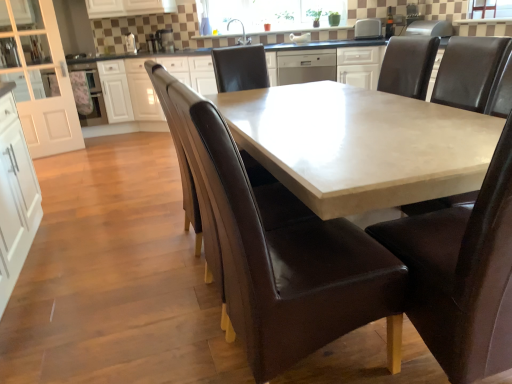
Question: Considering the positions of white glossy cabinet at center, acting as the first cabinetry starting from the right, and white plastic toaster at upper center, marked as the 1th appliance in a right-to-left arrangement, in the image, is white glossy cabinet at center, acting as the first cabinetry starting from the right, bigger or smaller than white plastic toaster at upper center, marked as the 1th appliance in a right-to-left arrangement,?

Choices:
 (A) small
 (B) big

Answer: (B)

Question: Is white glossy cabinet at center, which is the 2th cabinetry from left to right, to the left or to the right of white plastic toaster at upper center, which ranks as the fourth appliance in left-to-right order, in the image?

Choices:
 (A) right
 (B) left

Answer: (B)

Question: Which object is the farthest from the satin silver toaster at upper center, which is the 2th appliance from left to right?

Choices:
 (A) brown leather chair at center, acting as the 2th chair starting from the right
 (B) satin silver toaster at upper center, which appears as the 2th appliance when viewed from the back
 (C) white glossy cabinet at center, which is the 2th cabinetry from left to right
 (D) brown leather chair at center, which appears as the 1th chair when viewed from the left
 (E) satin silver dishwasher at center

Answer: (A)

Question: Which object is the closest to the brown leather chair at center, which is the 3th chair in left-to-right order?

Choices:
 (A) white glossy cabinet at left, the second cabinetry viewed from the right
 (B) metallic stainless steel toaster at upper center, the 3th appliance from the back
 (C) matte glass window screen at upper center, the first window screen from the left
 (D) white ceramic sink at upper center
 (E) brown leather chair at center, which appears as the 3th chair when viewed from the right

Answer: (E)